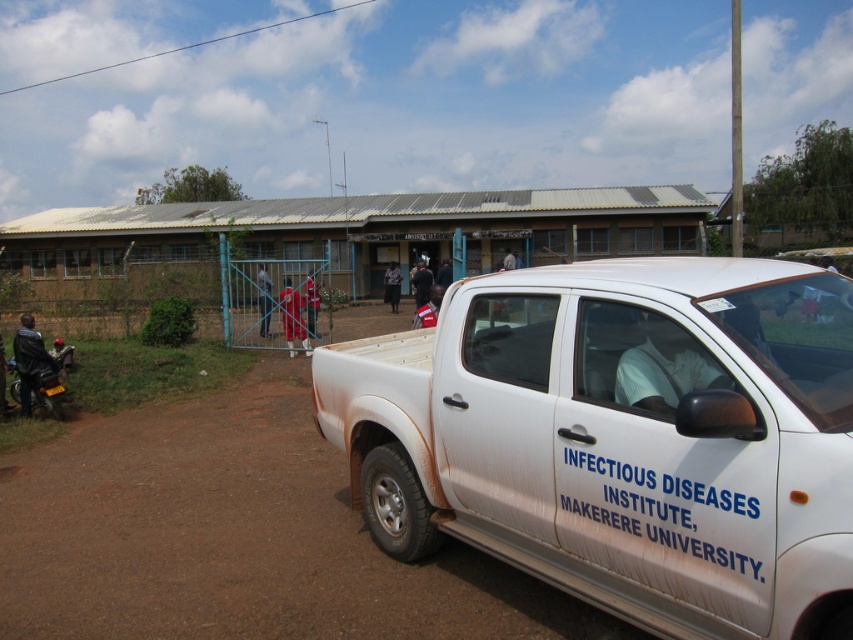
Question: Is red fabric cloth at center smaller than red fabric person at center?

Choices:
 (A) yes
 (B) no

Answer: (B)

Question: Does leather jacket at left appear on the right side of dark blue fabric pants at center?

Choices:
 (A) yes
 (B) no

Answer: (B)

Question: Among these points, which one is farthest from the camera?

Choices:
 (A) (393, 291)
 (B) (761, 294)
 (C) (39, 364)

Answer: (A)

Question: Among these objects, which one is farthest from the camera?

Choices:
 (A) white cotton shirt at center
 (B) red fabric cloth at center

Answer: (B)

Question: Is red fabric person at center smaller than dark blue fabric pants at center?

Choices:
 (A) yes
 (B) no

Answer: (A)

Question: Which of these objects is positioned farthest from the white matte truck at center?

Choices:
 (A) red fabric pants at center
 (B) dark blue fabric pants at center

Answer: (B)